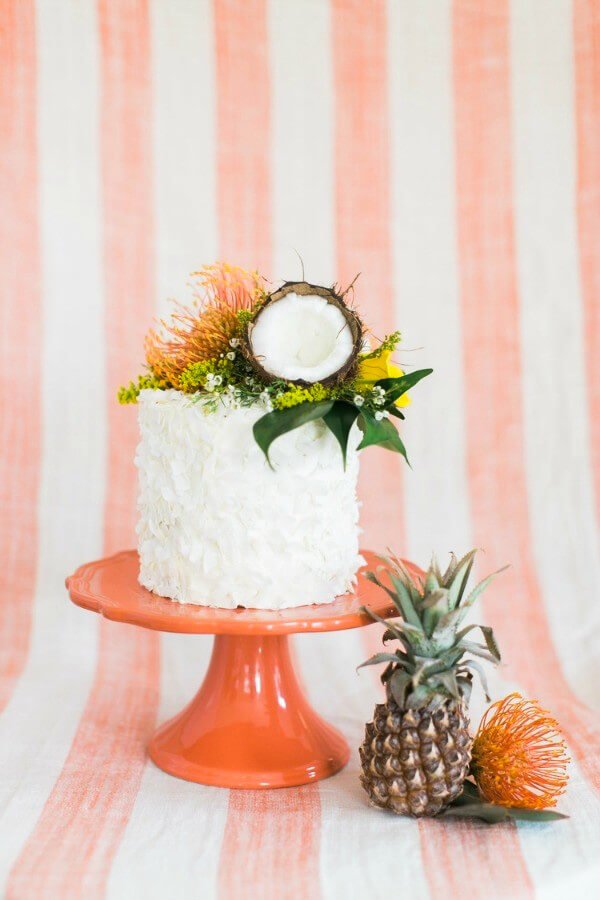
The height and width of the screenshot is (900, 600). Find the location of `cake stand`. cake stand is located at coordinates (245, 688).